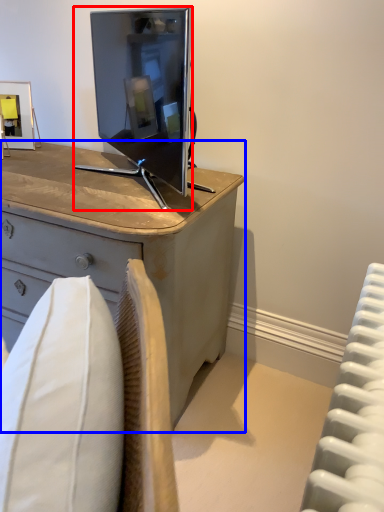
Question: Which object is closer to the camera taking this photo, television (highlighted by a red box) or desk (highlighted by a blue box)?

Choices:
 (A) television
 (B) desk

Answer: (B)